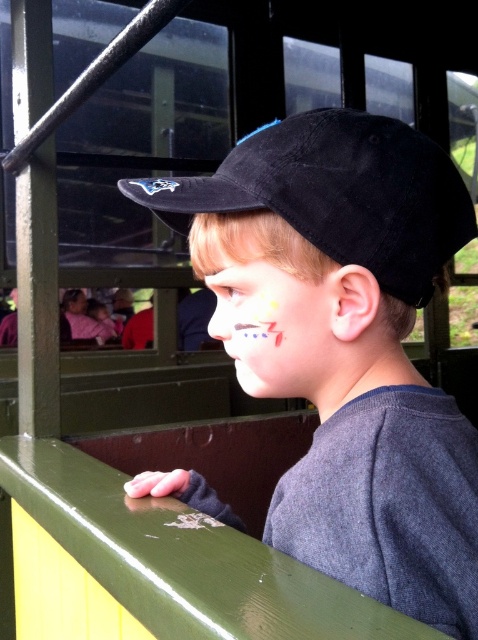
Between point (355, 218) and point (325, 124), which one is positioned behind?

Point (325, 124)

Between point (337, 534) and point (371, 230), which one is positioned in front?

Point (337, 534) is in front.

The image size is (478, 640). Find the location of `matte black cap at center`. matte black cap at center is located at coordinates (346, 342).

Is black suede baseball cap at center further to the viewer compared to matte paint face at center?

No, it is not.

Between black suede baseball cap at center and matte paint face at center, which one appears on the right side from the viewer's perspective?

Positioned to the right is black suede baseball cap at center.

The height and width of the screenshot is (640, 478). I want to click on black suede baseball cap at center, so click(x=337, y=193).

At what (x,y) coordinates should I click in order to perform the action: click on black suede baseball cap at center. Please return your answer as a coordinate pair (x, y). This screenshot has height=640, width=478. Looking at the image, I should click on (337, 193).

How much distance is there between matte black cap at center and matte paint face at center?

matte black cap at center is 7.16 centimeters from matte paint face at center.

Who is more forward, (311,132) or (307,268)?

Point (307,268) is in front.

Is point (273, 376) positioned before point (210, 246)?

No, (273, 376) is further to viewer.

You are a GUI agent. You are given a task and a screenshot of the screen. Output one action in this format:
    pyautogui.click(x=<x>, y=<y>)
    Task: Click on the matte black cap at center
    
    Given the screenshot: What is the action you would take?
    pyautogui.click(x=346, y=342)